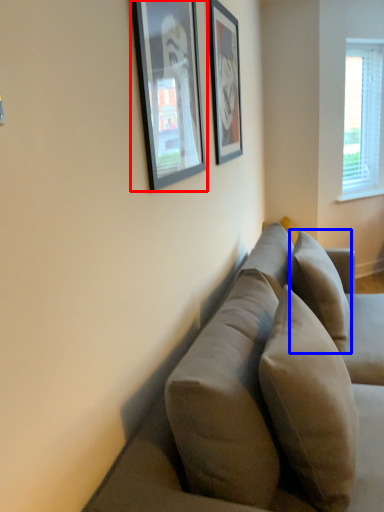
Question: Among these objects, which one is farthest to the camera, picture frame (highlighted by a red box) or pillow (highlighted by a blue box)?

Choices:
 (A) picture frame
 (B) pillow

Answer: (B)